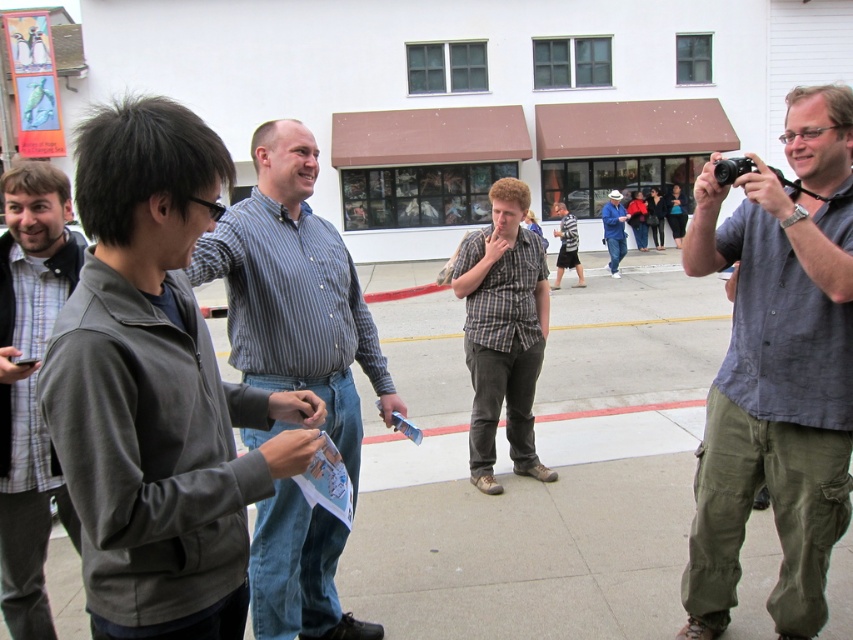
You are an event organizer planning to take a group photo of the two people wearing the gray matte jacket at left and the gray linen shirt at right. Which person should stand closer to the camera to ensure their clothing details are clearly visible?

The gray matte jacket at left is smaller than the gray linen shirt at right, so the person wearing the gray matte jacket at left should stand closer to the camera to ensure their clothing details are clearly visible.

You are standing at point (x=619, y=237) and want to walk to point (x=496, y=422). Which direction should you move in relation to the building with large windows?

Point (x=496, y=422) is in front of point (x=619, y=237), so you should move forward towards the building with large windows.